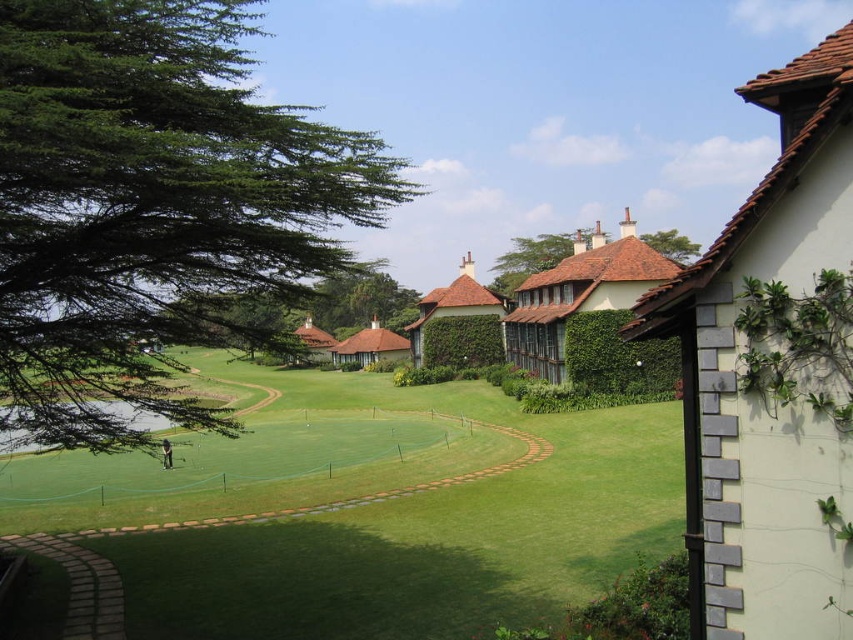
You are standing at the center of the golf course and want to place a small flag exactly halfway between point [62,3] and point [584,376]. Will the flag be closer to the building on the right or the green area?

The flag placed halfway between point [62,3] and point [584,376] will be closer to the green area because the halfway point would be closer to the lower left coordinates, which is near the green where you are standing, rather than the building on the right.

You are standing at the center of the golf course and see the point marked at coordinates (618, 355). What object is located at that point?

The point at coordinates 0.525, 0.725 corresponds to the green leafy hedge at center right.